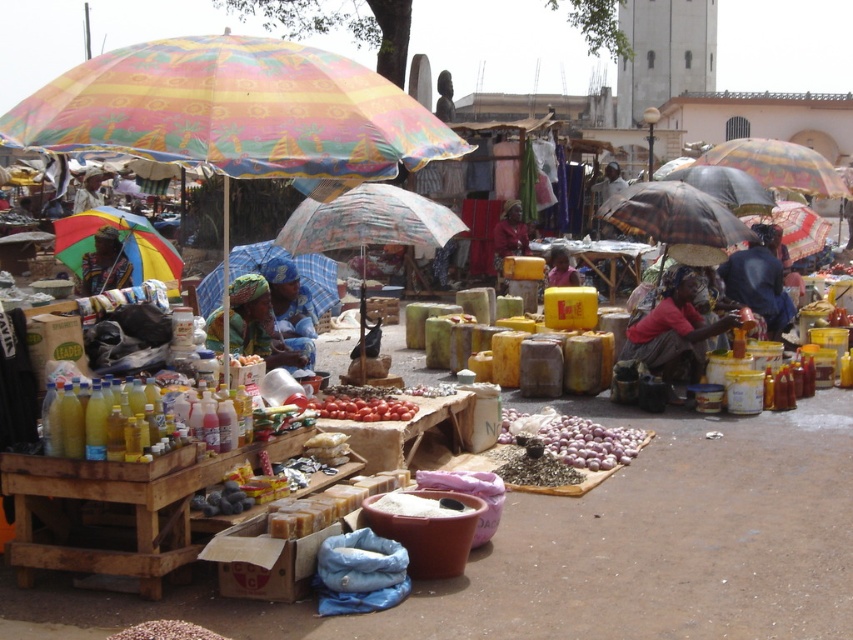
Does printed fabric umbrella at center have a greater width compared to blue plaid fabric umbrella at center?

Correct, the width of printed fabric umbrella at center exceeds that of blue plaid fabric umbrella at center.

How distant is printed fabric umbrella at center from blue plaid fabric umbrella at center?

printed fabric umbrella at center is 1.01 meters away from blue plaid fabric umbrella at center.

Is point (432, 232) positioned behind point (258, 244)?

No, (432, 232) is closer to viewer.

Where is `printed fabric umbrella at center`? printed fabric umbrella at center is located at coordinates point(368,221).

Is multicolored fabric umbrella at center bigger than white matte onions at center?

Yes.

Is multicolored fabric umbrella at center behind white matte onions at center?

That is True.

Is point (766, 179) positioned before point (611, 444)?

No, (766, 179) is further to viewer.

The height and width of the screenshot is (640, 853). I want to click on multicolored fabric umbrella at center, so click(778, 164).

Can you confirm if multicolored fabric umbrella at upper left is wider than matte black headscarf at upper left?

Yes, multicolored fabric umbrella at upper left is wider than matte black headscarf at upper left.

Image resolution: width=853 pixels, height=640 pixels. What do you see at coordinates (236, 113) in the screenshot?
I see `multicolored fabric umbrella at upper left` at bounding box center [236, 113].

Between point (268, 38) and point (97, 202), which one is positioned behind?

Point (97, 202)

You are a GUI agent. You are given a task and a screenshot of the screen. Output one action in this format:
    pyautogui.click(x=<x>, y=<y>)
    Task: Click on the multicolored fabric umbrella at upper left
    
    Given the screenshot: What is the action you would take?
    pyautogui.click(x=236, y=113)